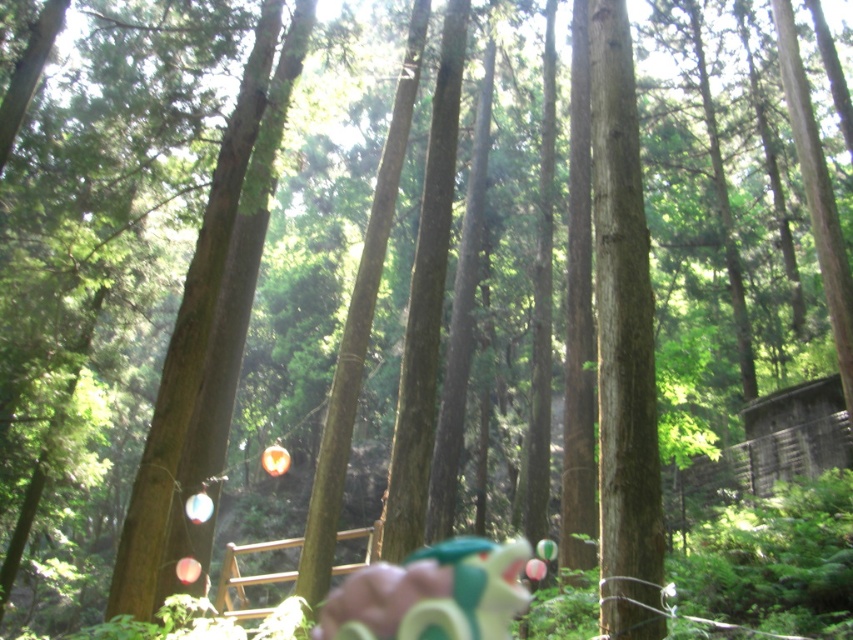
Question: Among these objects, which one is farthest from the camera?

Choices:
 (A) green rubber dragon at center
 (B) brown wooden fence at center

Answer: (B)

Question: Which point is farther to the camera?

Choices:
 (A) pyautogui.click(x=236, y=570)
 (B) pyautogui.click(x=448, y=573)

Answer: (A)

Question: Is green rubber dragon at center bigger than brown wooden fence at center?

Choices:
 (A) yes
 (B) no

Answer: (B)

Question: Does green rubber dragon at center lie in front of brown wooden fence at center?

Choices:
 (A) no
 (B) yes

Answer: (B)

Question: Is green rubber dragon at center below brown wooden fence at center?

Choices:
 (A) yes
 (B) no

Answer: (B)